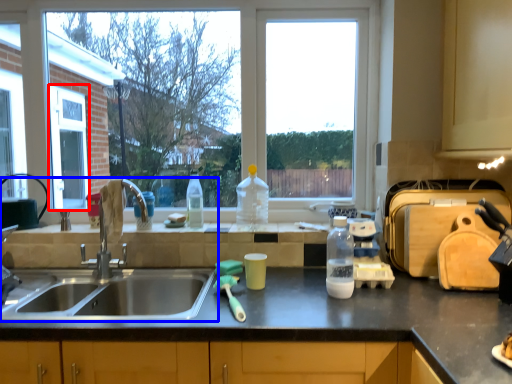
Question: Which object is closer to the camera taking this photo, screen door (highlighted by a red box) or sink (highlighted by a blue box)?

Choices:
 (A) screen door
 (B) sink

Answer: (B)